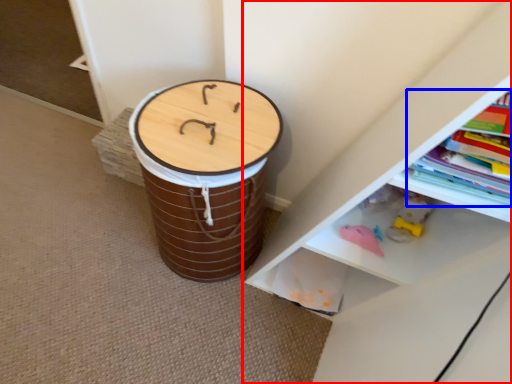
Question: Which of the following is the farthest to the observer, shelf (highlighted by a red box) or book (highlighted by a blue box)?

Choices:
 (A) shelf
 (B) book

Answer: (B)